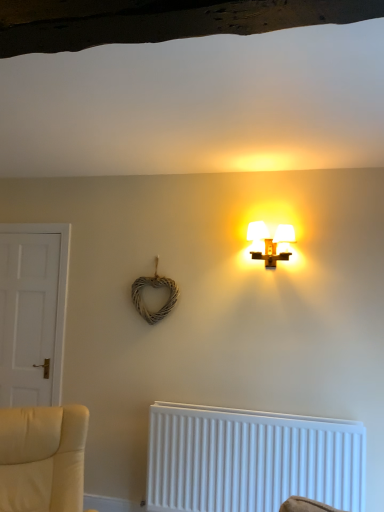
Question: Considering the relative sizes of matte white lamp at upper center and white plastic radiator at lower center in the image provided, is matte white lamp at upper center wider than white plastic radiator at lower center?

Choices:
 (A) yes
 (B) no

Answer: (A)

Question: Is matte white lamp at upper center closer to the viewer compared to white plastic radiator at lower center?

Choices:
 (A) yes
 (B) no

Answer: (B)

Question: Can you confirm if matte white lamp at upper center is smaller than white plastic radiator at lower center?

Choices:
 (A) yes
 (B) no

Answer: (A)

Question: Does matte white lamp at upper center have a lesser height compared to white plastic radiator at lower center?

Choices:
 (A) yes
 (B) no

Answer: (A)

Question: Does matte white lamp at upper center have a greater height compared to white plastic radiator at lower center?

Choices:
 (A) no
 (B) yes

Answer: (A)

Question: From the image's perspective, is matte white lamp at upper center located above or below white matte door at left?

Choices:
 (A) below
 (B) above

Answer: (B)

Question: Is matte white lamp at upper center taller or shorter than white matte door at left?

Choices:
 (A) short
 (B) tall

Answer: (A)

Question: Is matte white lamp at upper center inside the boundaries of white matte door at left, or outside?

Choices:
 (A) outside
 (B) inside

Answer: (A)

Question: In the image, is matte white lamp at upper center on the left side or the right side of white matte door at left?

Choices:
 (A) left
 (B) right

Answer: (B)

Question: In the image, is white matte door at left positioned in front of or behind matte white lamp at upper center?

Choices:
 (A) behind
 (B) front

Answer: (A)

Question: From the image's perspective, is white matte door at left positioned above or below matte white lamp at upper center?

Choices:
 (A) below
 (B) above

Answer: (A)

Question: Based on their positions, is white matte door at left located to the left or right of matte white lamp at upper center?

Choices:
 (A) left
 (B) right

Answer: (A)

Question: Is white matte door at left taller or shorter than matte white lamp at upper center?

Choices:
 (A) tall
 (B) short

Answer: (A)

Question: In the image, is matte white lamp at upper center on the left side or the right side of white plastic radiator at lower center?

Choices:
 (A) left
 (B) right

Answer: (B)

Question: From a real-world perspective, relative to white plastic radiator at lower center, is matte white lamp at upper center vertically above or below?

Choices:
 (A) above
 (B) below

Answer: (A)